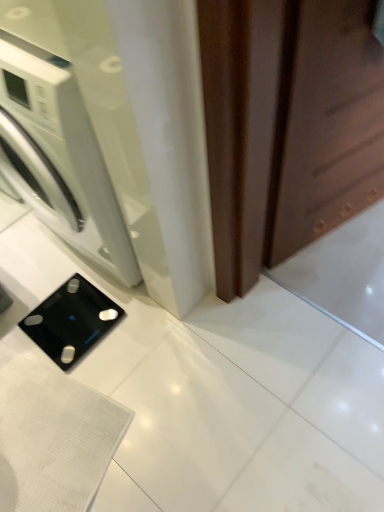
Question: Is white glossy washing machine at left spatially inside brown matte screen door at right, or outside of it?

Choices:
 (A) inside
 (B) outside

Answer: (B)

Question: In terms of height, does white glossy washing machine at left look taller or shorter compared to brown matte screen door at right?

Choices:
 (A) short
 (B) tall

Answer: (A)

Question: Which object is positioned farthest from the brown matte screen door at right?

Choices:
 (A) black glass scale at lower left
 (B) white glossy washing machine at left

Answer: (A)

Question: Which of these objects is positioned farthest from the white glossy washing machine at left?

Choices:
 (A) black glass scale at lower left
 (B) brown matte screen door at right

Answer: (B)